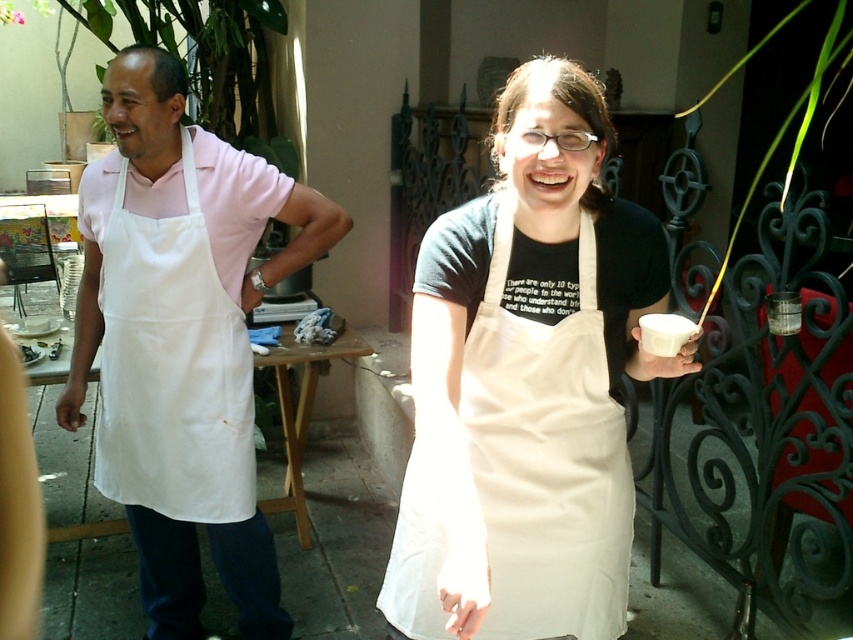
You are a delivery person who needs to place a 36 inch wide package between the white cotton apron at center and the white apron at left. Can the package fit in the space between them?

The distance between the white cotton apron at center and the white apron at left is 34.98 inches, which is slightly less than the 36 inch package. Therefore, the package cannot fit in the space between them.

What are the exact coordinates of the white cotton apron at center?

The white cotton apron at center is located at coordinates point (527, 385).